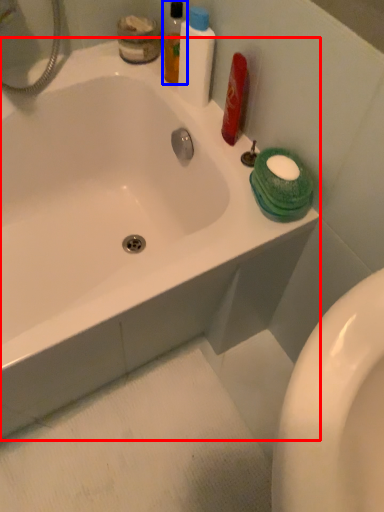
Question: Which object is closer to the camera taking this photo, bathtub (highlighted by a red box) or mouthwash (highlighted by a blue box)?

Choices:
 (A) bathtub
 (B) mouthwash

Answer: (A)